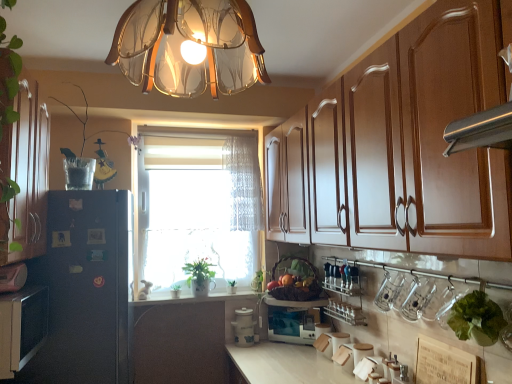
Locate an element on the screen. vacant space to the left of green leafy plant at window, the 1th plant from the back is located at coordinates (212, 295).